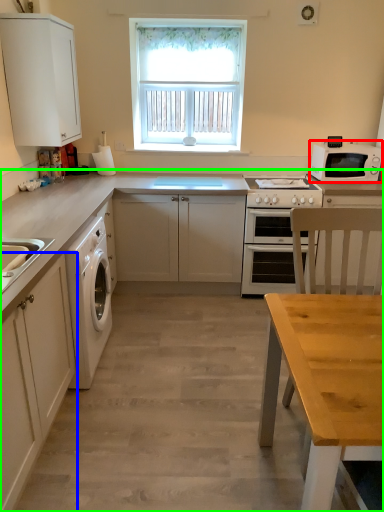
Question: Which object is positioned closest to kitchen appliance (highlighted by a red box)? Select from cabinetry (highlighted by a blue box) and countertop (highlighted by a green box).

Choices:
 (A) cabinetry
 (B) countertop

Answer: (B)